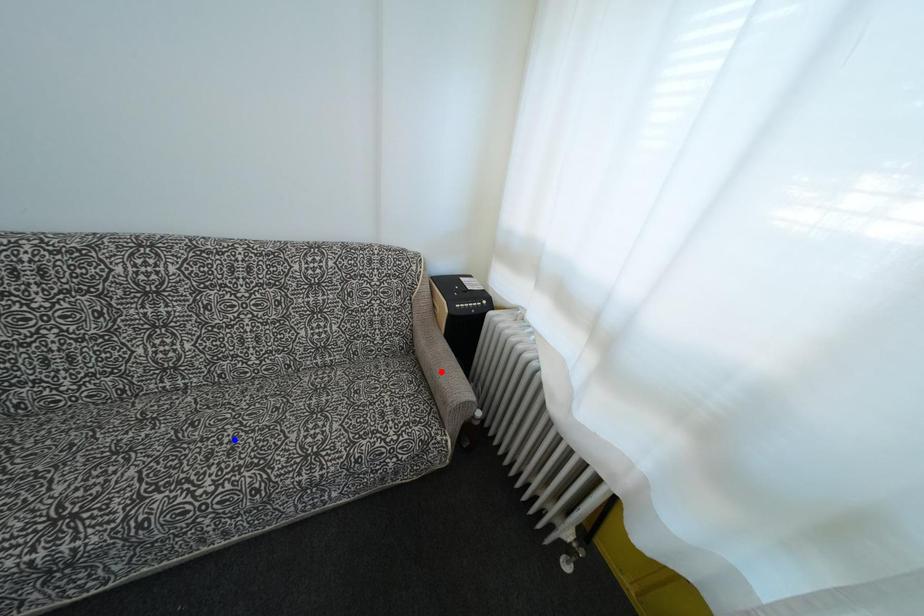
Question: Two points are marked on the image. Which point is closer to the camera?

Choices:
 (A) Blue point is closer.
 (B) Red point is closer.

Answer: (A)